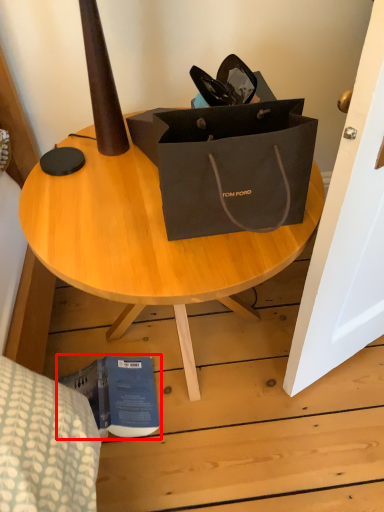
Question: From the image's perspective, what is the correct spatial positioning of book (annotated by the red box) in reference to coffee table?

Choices:
 (A) below
 (B) above

Answer: (A)